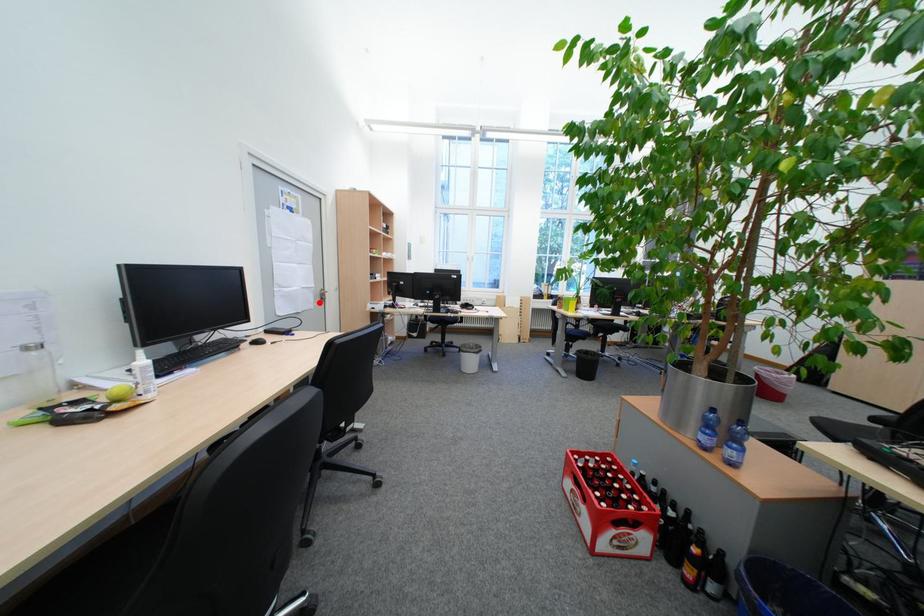
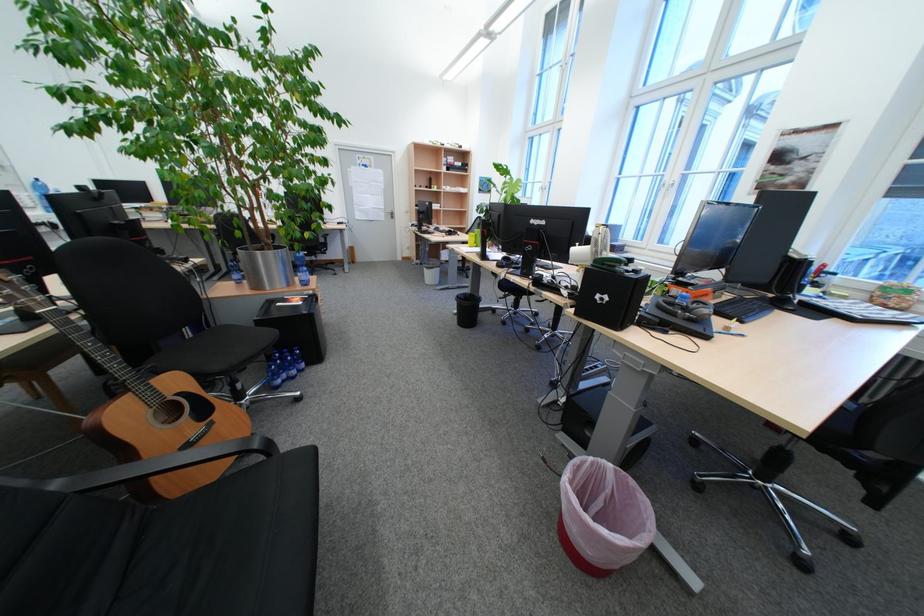
Question: I am providing you with two images of the same scene from different viewpoints. In image1, a red point is highlighted. Considering the same 3D point in image2, which of the following is correct?

Choices:
 (A) It is closer
 (B) It is farther

Answer: (A)